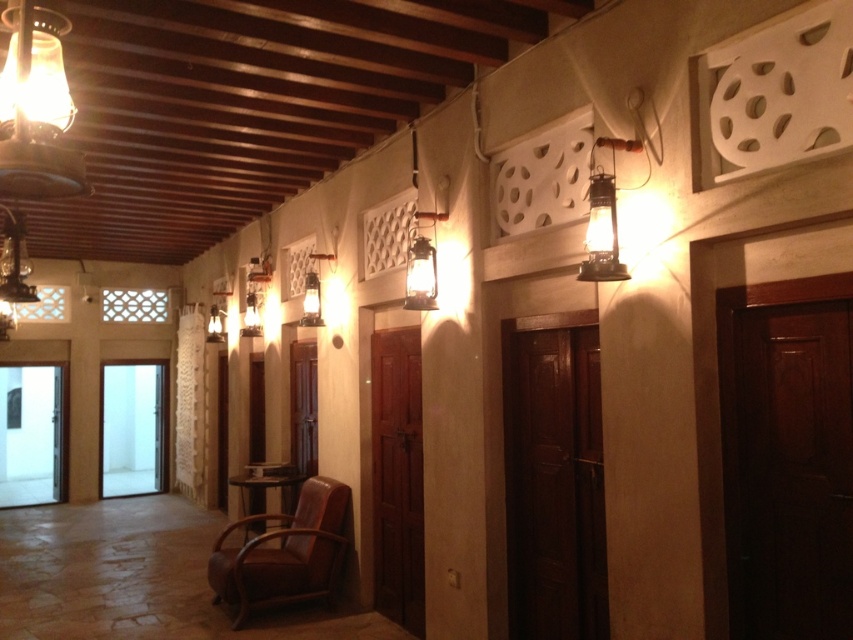
Question: Which of these objects is positioned farthest from the matte glass lamp at upper left?

Choices:
 (A) brown leather armchair at center
 (B) metallic lantern at upper right

Answer: (A)

Question: Does brown leather armchair at center have a smaller size compared to metallic lantern at upper right?

Choices:
 (A) no
 (B) yes

Answer: (A)

Question: Which point appears closest to the camera in this image?

Choices:
 (A) (209, 560)
 (B) (585, 241)
 (C) (86, 179)
 (D) (154, 429)

Answer: (C)

Question: Observing the image, what is the correct spatial positioning of matte glass lamp at upper left in reference to white glossy door at center?

Choices:
 (A) right
 (B) left

Answer: (A)

Question: Can you confirm if matte glass lamp at upper left is thinner than brown leather armchair at center?

Choices:
 (A) yes
 (B) no

Answer: (A)

Question: Which object is the closest to the metallic lantern at upper right?

Choices:
 (A) brown leather armchair at center
 (B) matte glass lamp at upper left
 (C) white glossy door at center

Answer: (B)